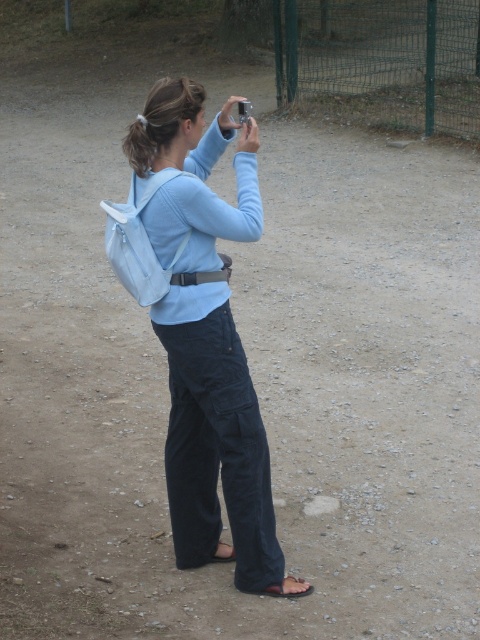
Is light blue fabric backpack at center above green wire mesh fence at upper right?

Incorrect, light blue fabric backpack at center is not positioned above green wire mesh fence at upper right.

Does light blue fabric backpack at center appear under green wire mesh fence at upper right?

Correct, light blue fabric backpack at center is located below green wire mesh fence at upper right.

Does point (168, 202) come farther from viewer compared to point (292, 17)?

No.

Find the location of a particular element. The height and width of the screenshot is (640, 480). light blue fabric backpack at center is located at coordinates pos(200,328).